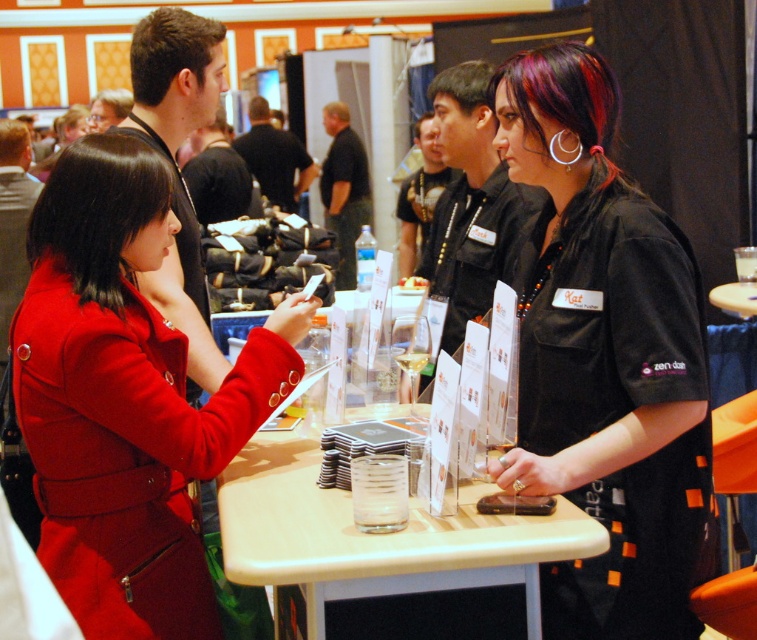
You are a photographer at the event and want to capture a photo of both the black silky hair at left and brown matte hair at upper left without any overlap. Based on their positions, which one should you focus on first to ensure they both fit in the frame?

The black silky hair at left is taller than the brown matte hair at upper left, so you should focus on positioning the camera to include the taller black silky hair at left first, ensuring there is enough vertical space for both.

You are attending a conference and want to place your matte red coat at left on the translucent plastic table at center. Is there enough space between them for you to do so?

The matte red coat at left is 15.03 inches away from the translucent plastic table at center, so there is sufficient space to place the coat on the table.